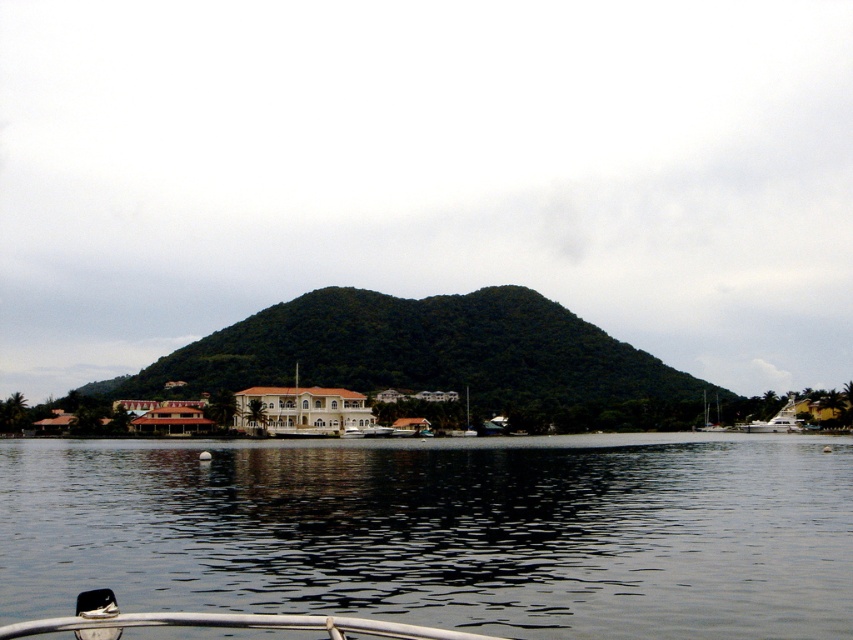
Does white glossy boat at lower right have a greater height compared to white glossy sailboat at lower right?

Correct, white glossy boat at lower right is much taller as white glossy sailboat at lower right.

The image size is (853, 640). Describe the element at coordinates (778, 420) in the screenshot. I see `white glossy boat at lower right` at that location.

Is point (785, 404) behind point (717, 401)?

No, (785, 404) is closer to viewer.

Where is `white glossy boat at lower right`? This screenshot has width=853, height=640. white glossy boat at lower right is located at coordinates (778, 420).

Can you confirm if green leafy mountain at center is shorter than white glossy sailboat at lower right?

No.

Is green leafy mountain at center taller than white glossy sailboat at lower right?

Yes, green leafy mountain at center is taller than white glossy sailboat at lower right.

Between point (585, 392) and point (708, 412), which one is positioned behind?

Point (585, 392)

You are a GUI agent. You are given a task and a screenshot of the screen. Output one action in this format:
    pyautogui.click(x=<x>, y=<y>)
    Task: Click on the green leafy mountain at center
    
    Given the screenshot: What is the action you would take?
    pyautogui.click(x=439, y=358)

What do you see at coordinates (440, 532) in the screenshot? I see `transparent water at center` at bounding box center [440, 532].

Which is behind, point (375, 483) or point (722, 429)?

Point (722, 429)

Which is in front, point (735, 538) or point (724, 428)?

Positioned in front is point (735, 538).

This screenshot has width=853, height=640. Find the location of `transparent water at center`. transparent water at center is located at coordinates (440, 532).